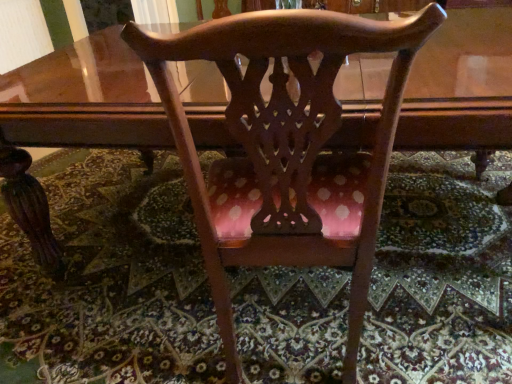
Locate an element on the screen. This screenshot has height=384, width=512. carpeted floor at center is located at coordinates (110, 280).

Describe the element at coordinates (110, 280) in the screenshot. I see `carpeted floor at center` at that location.

Locate an element on the screen. polished wood chair at center is located at coordinates (286, 148).

What do you see at coordinates (286, 148) in the screenshot? This screenshot has width=512, height=384. I see `polished wood chair at center` at bounding box center [286, 148].

Identify the location of carpeted floor at center. Image resolution: width=512 pixels, height=384 pixels. (110, 280).

Does polished wood chair at center appear on the left side of carpeted floor at center?

In fact, polished wood chair at center is to the right of carpeted floor at center.

Which object is closer to the camera taking this photo, polished wood chair at center or carpeted floor at center?

polished wood chair at center is closer to the camera.

Is point (303, 184) positioned in front of point (7, 350)?

Yes, point (303, 184) is closer to viewer.

From the image's perspective, relative to carpeted floor at center, is polished wood chair at center above or below?

Clearly, from the image's perspective, polished wood chair at center is above carpeted floor at center.

From a real-world perspective, who is located higher, polished wood chair at center or carpeted floor at center?

In real-world perspective, polished wood chair at center is above.

Is polished wood chair at center thinner than carpeted floor at center?

Correct, the width of polished wood chair at center is less than that of carpeted floor at center.

Considering the sizes of objects polished wood chair at center and carpeted floor at center in the image provided, who is taller, polished wood chair at center or carpeted floor at center?

Standing taller between the two is polished wood chair at center.

Which of these two, polished wood chair at center or carpeted floor at center, is bigger?

polished wood chair at center is bigger.

Is polished wood chair at center completely or partially outside of carpeted floor at center?

Yes, polished wood chair at center is not within carpeted floor at center.

Is polished wood chair at center beside carpeted floor at center?

No, polished wood chair at center is not making contact with carpeted floor at center.

Is polished wood chair at center facing towards carpeted floor at center?

No, polished wood chair at center is not turned towards carpeted floor at center.

This screenshot has width=512, height=384. I want to click on chair in front of the carpeted floor at center, so click(x=286, y=148).

From the picture: Is carpeted floor at center to the left or to the right of polished wood chair at center in the image?

In the image, carpeted floor at center appears on the left side of polished wood chair at center.

Does carpeted floor at center lie in front of polished wood chair at center?

No, carpeted floor at center is further to the viewer.

Considering the points (117, 220) and (430, 10), which point is in front, point (117, 220) or point (430, 10)?

The point (430, 10) is closer to the camera.

From the image's perspective, which one is positioned higher, carpeted floor at center or polished wood chair at center?

polished wood chair at center is shown above in the image.

From a real-world perspective, between carpeted floor at center and polished wood chair at center, who is vertically higher?

polished wood chair at center, from a real-world perspective.

Consider the image. In terms of width, does carpeted floor at center look wider or thinner when compared to polished wood chair at center?

Clearly, carpeted floor at center has more width compared to polished wood chair at center.

From their relative heights in the image, would you say carpeted floor at center is taller or shorter than polished wood chair at center?

Clearly, carpeted floor at center is shorter compared to polished wood chair at center.

Considering the relative sizes of carpeted floor at center and polished wood chair at center in the image provided, is carpeted floor at center bigger than polished wood chair at center?

Actually, carpeted floor at center might be smaller than polished wood chair at center.

Could polished wood chair at center be considered to be inside carpeted floor at center?

No, polished wood chair at center is not inside carpeted floor at center.

Is carpeted floor at center in contact with polished wood chair at center?

No, carpeted floor at center is not beside polished wood chair at center.

Could you tell me if carpeted floor at center is facing polished wood chair at center?

No, carpeted floor at center is not facing towards polished wood chair at center.

Can you tell me how much carpeted floor at center and polished wood chair at center differ in facing direction?

The angular difference between carpeted floor at center and polished wood chair at center is 3.79 degrees.

This screenshot has height=384, width=512. I want to click on mat lying below the polished wood chair at center (from the image's perspective), so click(x=110, y=280).

You are a GUI agent. You are given a task and a screenshot of the screen. Output one action in this format:
    pyautogui.click(x=<x>, y=<y>)
    Task: Click on the mat lying below the polished wood chair at center (from the image's perspective)
    This screenshot has width=512, height=384.
    Given the screenshot: What is the action you would take?
    pyautogui.click(x=110, y=280)

Where is `chair in front of the carpeted floor at center`? The width and height of the screenshot is (512, 384). chair in front of the carpeted floor at center is located at coordinates (286, 148).